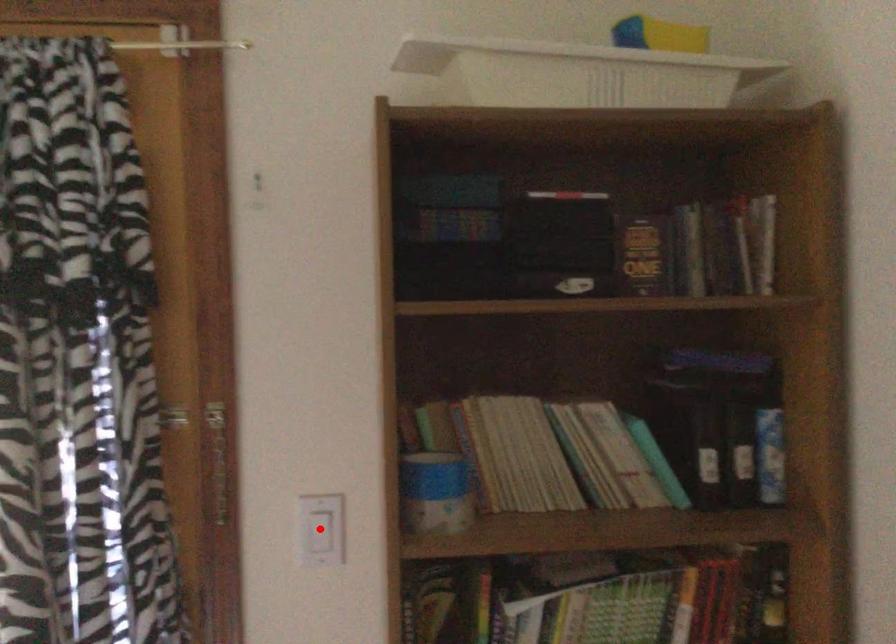
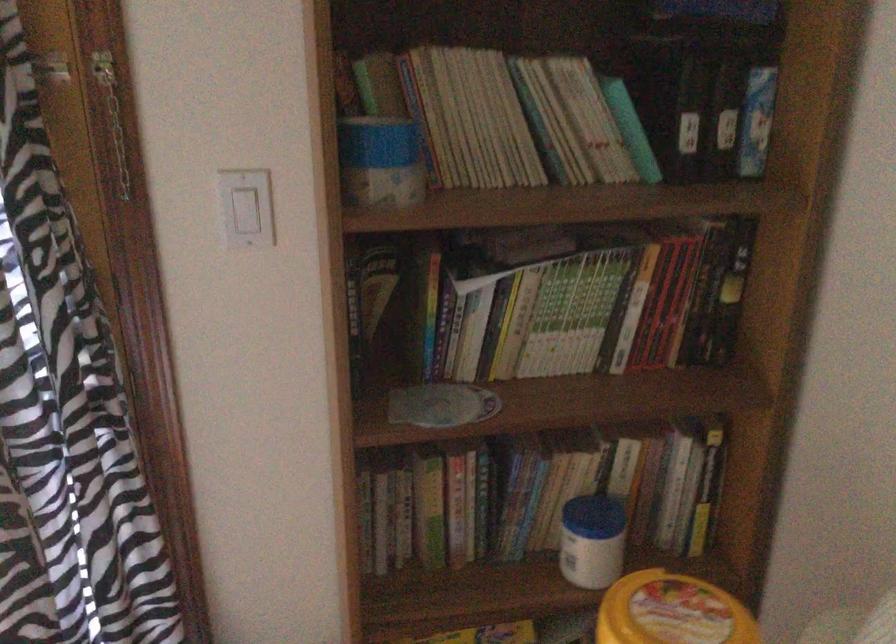
Locate, in the second image, the point that corresponds to the highlighted location in the first image.

(246, 207)